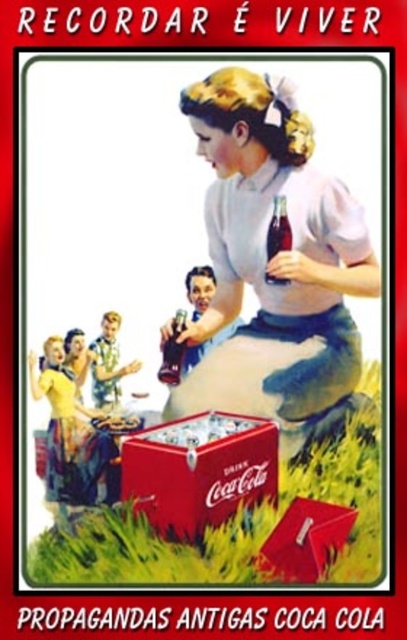
Does point (63, 497) lie behind point (273, 228)?

Yes, point (63, 497) is farther from viewer.

Measure the distance between yellow fabric dress at lower left and camera.

A distance of 4.45 feet exists between yellow fabric dress at lower left and camera.

Where is `yellow fabric dress at lower left`? yellow fabric dress at lower left is located at coordinates (72, 435).

Is matte white dress at center to the left of matte red cooler at lower center from the viewer's perspective?

No, matte white dress at center is not to the left of matte red cooler at lower center.

Who is positioned more to the left, matte white dress at center or matte red cooler at lower center?

From the viewer's perspective, matte red cooler at lower center appears more on the left side.

Locate an element on the screen. This screenshot has height=640, width=407. matte white dress at center is located at coordinates (275, 266).

Does matte red cooler at lower center have a lesser height compared to translucent glass bottle at center?

Correct, matte red cooler at lower center is not as tall as translucent glass bottle at center.

Does matte red cooler at lower center have a greater width compared to translucent glass bottle at center?

Yes, matte red cooler at lower center is wider than translucent glass bottle at center.

Identify the location of matte red cooler at lower center. (199, 470).

The height and width of the screenshot is (640, 407). I want to click on matte red cooler at lower center, so click(x=199, y=470).